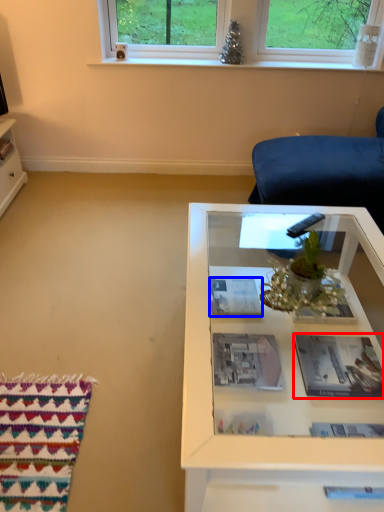
Question: Which of the following is the farthest to the observer, magazine (highlighted by a red box) or magazine (highlighted by a blue box)?

Choices:
 (A) magazine
 (B) magazine

Answer: (B)